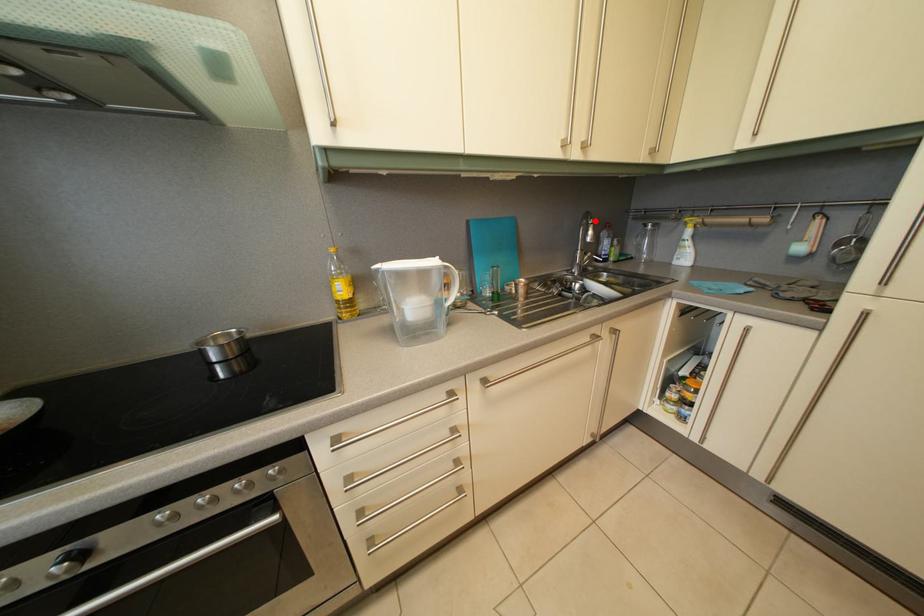
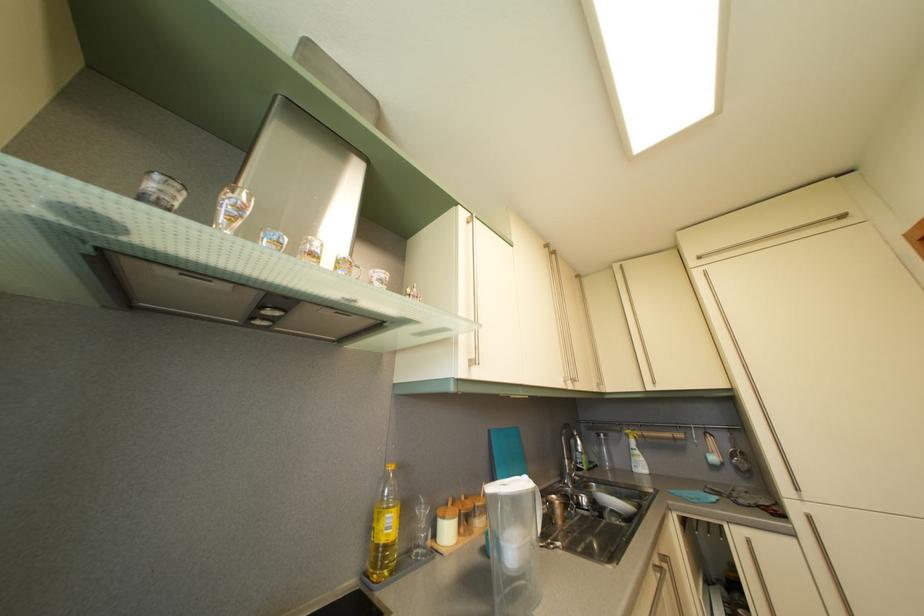
The point at the highlighted location is marked in the first image. Where is the corresponding point in the second image?

(575, 432)